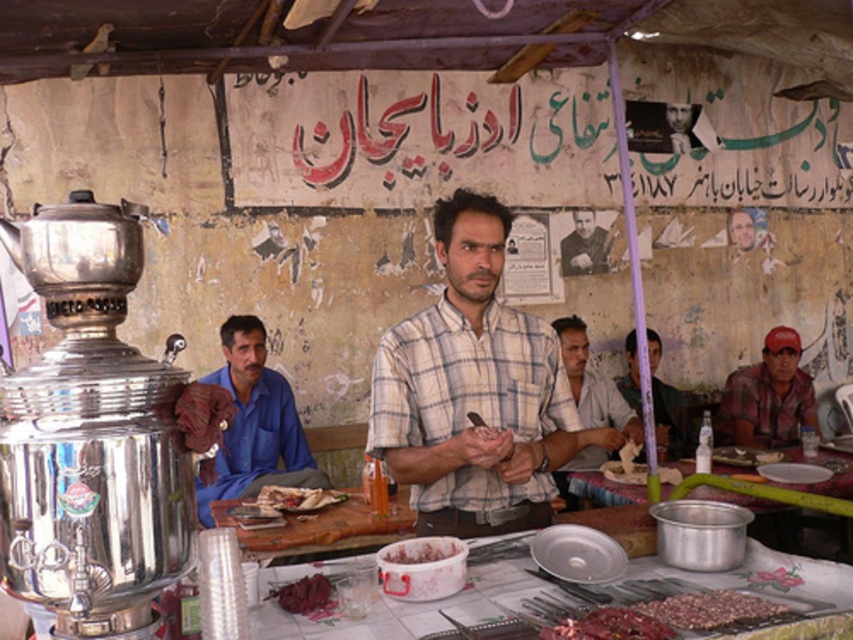
Question: Which of the following is the farthest from the observer?

Choices:
 (A) metallic silver pot at center
 (B) dark red meat skewer at center

Answer: (A)

Question: Does white checkered shirt at center have a greater width compared to metallic silver tray at center?

Choices:
 (A) yes
 (B) no

Answer: (B)

Question: Which point appears farthest from the camera in this image?

Choices:
 (A) (579, 246)
 (B) (345, 563)
 (C) (746, 500)
 (D) (305, 611)

Answer: (A)

Question: Which point is farther from the camera taking this photo?

Choices:
 (A) (585, 632)
 (B) (674, 598)
 (C) (602, 244)

Answer: (C)

Question: Is metallic silver pot at center positioned at the back of dark red meat skewer at center?

Choices:
 (A) no
 (B) yes

Answer: (B)

Question: Is white checkered shirt at center further to camera compared to plaid shirt at center?

Choices:
 (A) no
 (B) yes

Answer: (A)